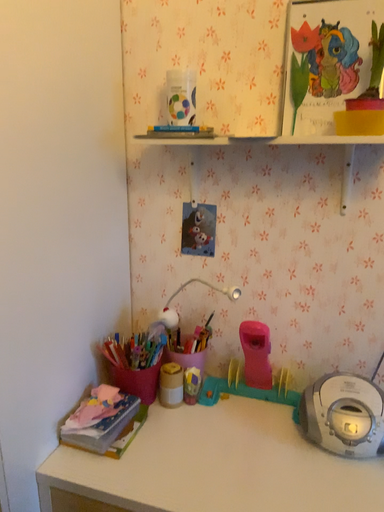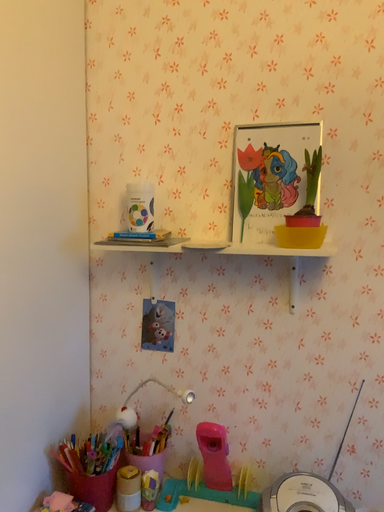
Question: How did the camera likely rotate when shooting the video?

Choices:
 (A) rotated downward
 (B) rotated upward

Answer: (B)